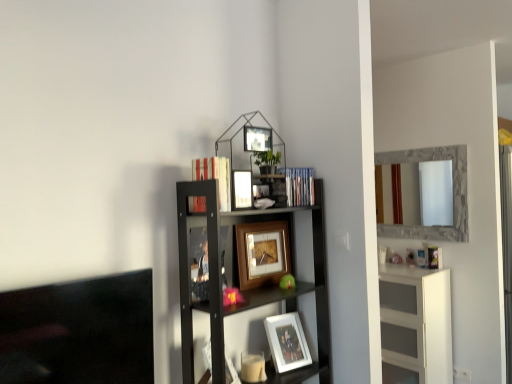
Find the location of a particular element. The height and width of the screenshot is (384, 512). hardcover book at upper center, positioned as the 2th book in right-to-left order is located at coordinates (215, 176).

The height and width of the screenshot is (384, 512). Identify the location of black wood shelf at upper right. (249, 289).

You are a GUI agent. You are given a task and a screenshot of the screen. Output one action in this format:
    pyautogui.click(x=<x>, y=<y>)
    Task: Click on the white matte picture frame at lower center, positioned as the fourth picture frame in top-to-bottom order
    The image size is (512, 384).
    Given the screenshot: What is the action you would take?
    pyautogui.click(x=287, y=342)

What do you see at coordinates (300, 187) in the screenshot?
I see `blue plastic book at upper right, arranged as the second book when viewed from the front` at bounding box center [300, 187].

Measure the distance between matte glass picture frame at upper center, the third picture frame in the bottom-to-top sequence, and camera.

matte glass picture frame at upper center, the third picture frame in the bottom-to-top sequence, and camera are 1.62 meters apart.

I want to click on white glossy cabinet at right, so click(417, 321).

From a real-world perspective, is hardcover book at upper center, positioned as the 2th book in right-to-left order, under stone-framed mirror at right?

No, from a real-world perspective, hardcover book at upper center, positioned as the 2th book in right-to-left order, is not below stone-framed mirror at right.

Where is `mirror that appears on the right of hardcover book at upper center, the 2th book in the back-to-front sequence`? mirror that appears on the right of hardcover book at upper center, the 2th book in the back-to-front sequence is located at coordinates (453, 194).

In the scene shown: Is hardcover book at upper center, positioned as the 2th book in right-to-left order, to the right of stone-framed mirror at right from the viewer's perspective?

No.

Measure the distance from hardcover book at upper center, positioned as the 2th book in right-to-left order, to stone-framed mirror at right.

hardcover book at upper center, positioned as the 2th book in right-to-left order, is 6.97 feet from stone-framed mirror at right.

Is white glossy cabinet at right wider than wooden picture frame at center, the 2th picture frame positioned from the bottom?

Indeed, white glossy cabinet at right has a greater width compared to wooden picture frame at center, the 2th picture frame positioned from the bottom.

Between point (408, 315) and point (276, 249), which one is positioned behind?

The point (408, 315) is more distant.

Considering the relative positions of white glossy cabinet at right and wooden picture frame at center, the 2th picture frame positioned from the bottom, in the image provided, is white glossy cabinet at right in front of wooden picture frame at center, the 2th picture frame positioned from the bottom,?

No, it is not.

Does white glossy cabinet at right appear on the right side of wooden picture frame at center, which appears as the 3th picture frame when viewed from the top?

Yes.

Would you say metallic silver picture frame at upper center, the 1th picture frame in the top-to-bottom sequence, is a long distance from matte glass picture frame at upper center, marked as the 2th picture frame in a top-to-bottom arrangement?

No.

Find the location of a particular element. the 1st picture frame below the metallic silver picture frame at upper center, the fourth picture frame in the bottom-to-top sequence (from a real-world perspective) is located at coordinates (241, 190).

Could you measure the distance between metallic silver picture frame at upper center, the fourth picture frame in the bottom-to-top sequence, and matte glass picture frame at upper center, marked as the 2th picture frame in a top-to-bottom arrangement?

metallic silver picture frame at upper center, the fourth picture frame in the bottom-to-top sequence, and matte glass picture frame at upper center, marked as the 2th picture frame in a top-to-bottom arrangement, are 6.76 inches apart.

Considering the relative positions of metallic silver picture frame at upper center, the fourth picture frame in the bottom-to-top sequence, and matte glass picture frame at upper center, the third picture frame in the bottom-to-top sequence, in the image provided, is metallic silver picture frame at upper center, the fourth picture frame in the bottom-to-top sequence, behind matte glass picture frame at upper center, the third picture frame in the bottom-to-top sequence,?

Yes, metallic silver picture frame at upper center, the fourth picture frame in the bottom-to-top sequence, is further from the viewer.

In the image, is blue plastic book at upper right, arranged as the second book when viewed from the front, on the left side or the right side of stone-framed mirror at right?

From the image, it's evident that blue plastic book at upper right, arranged as the second book when viewed from the front, is to the left of stone-framed mirror at right.

Locate an element on the screen. The image size is (512, 384). mirror behind the blue plastic book at upper right, marked as the 2th book in a left-to-right arrangement is located at coordinates (453, 194).

What's the angular difference between blue plastic book at upper right, arranged as the second book when viewed from the front, and stone-framed mirror at right's facing directions?

There is a 84.6-degree angle between the facing directions of blue plastic book at upper right, arranged as the second book when viewed from the front, and stone-framed mirror at right.

Is blue plastic book at upper right, which is counted as the 1th book, starting from the back, in contact with stone-framed mirror at right?

No, blue plastic book at upper right, which is counted as the 1th book, starting from the back, is not next to stone-framed mirror at right.

Based on the photo, who is more distant, blue plastic book at upper right, marked as the 2th book in a left-to-right arrangement, or matte glass picture frame at upper center, marked as the 2th picture frame in a top-to-bottom arrangement?

blue plastic book at upper right, marked as the 2th book in a left-to-right arrangement, is behind.

Locate an element on the screen. picture frame that is the 1st one when counting downward from the blue plastic book at upper right, arranged as the second book when viewed from the front (from the image's perspective) is located at coordinates (241, 190).

Is matte glass picture frame at upper center, marked as the 2th picture frame in a top-to-bottom arrangement, inside blue plastic book at upper right, marked as the 2th book in a left-to-right arrangement?

No.

From the picture: Considering the sizes of objects blue plastic book at upper right, the 1th book positioned from the right, and matte glass picture frame at upper center, marked as the 2th picture frame in a top-to-bottom arrangement, in the image provided, who is wider, blue plastic book at upper right, the 1th book positioned from the right, or matte glass picture frame at upper center, marked as the 2th picture frame in a top-to-bottom arrangement,?

Wider between the two is blue plastic book at upper right, the 1th book positioned from the right.

Would you consider black wood shelf at upper right to be distant from hardcover book at upper center, positioned as the 2th book in right-to-left order?

No, there isn't a large distance between black wood shelf at upper right and hardcover book at upper center, positioned as the 2th book in right-to-left order.

Based on the photo, is black wood shelf at upper right completely or partially outside of hardcover book at upper center, which is the first book in front-to-back order?

That's correct, black wood shelf at upper right is outside of hardcover book at upper center, which is the first book in front-to-back order.

Is black wood shelf at upper right oriented towards hardcover book at upper center, the 2th book in the back-to-front sequence?

No, black wood shelf at upper right is not facing towards hardcover book at upper center, the 2th book in the back-to-front sequence.

Based on their sizes in the image, would you say black wood shelf at upper right is bigger or smaller than hardcover book at upper center, the 1th book in the left-to-right sequence?

Considering their sizes, black wood shelf at upper right takes up more space than hardcover book at upper center, the 1th book in the left-to-right sequence.

Who is smaller, stone-framed mirror at right or hardcover book at upper center, the 1th book in the left-to-right sequence?

With smaller size is hardcover book at upper center, the 1th book in the left-to-right sequence.

From a real-world perspective, relative to hardcover book at upper center, which is the first book in front-to-back order, is stone-framed mirror at right vertically above or below?

In terms of real-world spatial position, stone-framed mirror at right is below hardcover book at upper center, which is the first book in front-to-back order.

Is stone-framed mirror at right wider than hardcover book at upper center, positioned as the 2th book in right-to-left order?

No, stone-framed mirror at right is not wider than hardcover book at upper center, positioned as the 2th book in right-to-left order.

Who is taller, stone-framed mirror at right or hardcover book at upper center, positioned as the 2th book in right-to-left order?

stone-framed mirror at right is taller.

The width and height of the screenshot is (512, 384). Identify the location of book that is the 2nd object above the stone-framed mirror at right (from a real-world perspective). (215, 176).

Locate an element on the screen. This screenshot has width=512, height=384. the 2nd picture frame to the left when counting from the white glossy cabinet at right is located at coordinates (262, 253).

When comparing their distances from metallic silver picture frame at upper center, the 1th picture frame in the top-to-bottom sequence, does black wood shelf at upper right or blue plastic book at upper right, arranged as the second book when viewed from the front, seem closer?

Among the two, blue plastic book at upper right, arranged as the second book when viewed from the front, is located nearer to metallic silver picture frame at upper center, the 1th picture frame in the top-to-bottom sequence.

Considering their positions, is stone-framed mirror at right positioned closer to white glossy cabinet at right than metallic silver picture frame at upper center, the 1th picture frame in the top-to-bottom sequence?

The object closer to white glossy cabinet at right is stone-framed mirror at right.

Considering their positions, is matte glass picture frame at upper center, marked as the 2th picture frame in a top-to-bottom arrangement, positioned further to white glossy cabinet at right than white matte picture frame at lower center, positioned as the fourth picture frame in top-to-bottom order?

matte glass picture frame at upper center, marked as the 2th picture frame in a top-to-bottom arrangement, lies further to white glossy cabinet at right than the other object.

Based on their spatial positions, is stone-framed mirror at right or metallic silver picture frame at upper center, the 1th picture frame in the top-to-bottom sequence, closer to white matte picture frame at lower center, positioned as the fourth picture frame in top-to-bottom order?

metallic silver picture frame at upper center, the 1th picture frame in the top-to-bottom sequence, lies closer to white matte picture frame at lower center, positioned as the fourth picture frame in top-to-bottom order, than the other object.

When comparing their distances from metallic silver picture frame at upper center, the 1th picture frame in the top-to-bottom sequence, does hardcover book at upper center, positioned as the 2th book in right-to-left order, or matte glass picture frame at upper center, the third picture frame in the bottom-to-top sequence, seem further?

The object further to metallic silver picture frame at upper center, the 1th picture frame in the top-to-bottom sequence, is hardcover book at upper center, positioned as the 2th book in right-to-left order.

Estimate the real-world distances between objects in this image. Which object is closer to hardcover book at upper center, positioned as the 2th book in right-to-left order, white matte picture frame at lower center, positioned as the fourth picture frame in top-to-bottom order, or stone-framed mirror at right?

Among the two, white matte picture frame at lower center, positioned as the fourth picture frame in top-to-bottom order, is located nearer to hardcover book at upper center, positioned as the 2th book in right-to-left order.

Based on their spatial positions, is hardcover book at upper center, positioned as the 2th book in right-to-left order, or blue plastic book at upper right, which is counted as the 1th book, starting from the back, further from white matte picture frame at lower center, positioned as the fourth picture frame in top-to-bottom order?

hardcover book at upper center, positioned as the 2th book in right-to-left order, is further to white matte picture frame at lower center, positioned as the fourth picture frame in top-to-bottom order.

Which object lies further to the anchor point hardcover book at upper center, which is the first book in front-to-back order, stone-framed mirror at right or blue plastic book at upper right, which is counted as the 1th book, starting from the back?

Among the two, stone-framed mirror at right is located further to hardcover book at upper center, which is the first book in front-to-back order.

The height and width of the screenshot is (384, 512). Identify the location of shelf between blue plastic book at upper right, which is counted as the 1th book, starting from the back, and white matte picture frame at lower center, positioned as the fourth picture frame in top-to-bottom order, from top to bottom. (249, 289).

The image size is (512, 384). Identify the location of book positioned between hardcover book at upper center, positioned as the 2th book in right-to-left order, and stone-framed mirror at right from near to far. [x=300, y=187].

Locate an element on the screen. This screenshot has height=384, width=512. shelf between hardcover book at upper center, which is the first book in front-to-back order, and white matte picture frame at lower center, positioned as the fourth picture frame in top-to-bottom order, vertically is located at coordinates (249, 289).

At what (x,y) coordinates should I click in order to perform the action: click on picture frame between matte glass picture frame at upper center, the third picture frame in the bottom-to-top sequence, and black wood shelf at upper right vertically. Please return your answer as a coordinate pair (x, y). The height and width of the screenshot is (384, 512). Looking at the image, I should click on pyautogui.click(x=262, y=253).